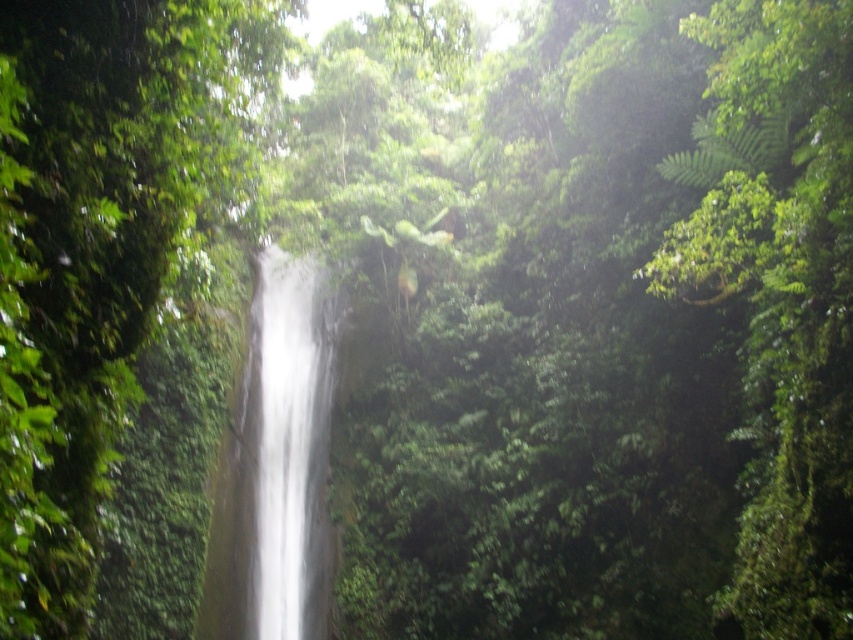
Who is shorter, green leafy tree at center or green leafy tree at right?

green leafy tree at center is shorter.

Is green leafy tree at center positioned before green leafy tree at right?

Yes, green leafy tree at center is closer to the viewer.

What do you see at coordinates (102, 246) in the screenshot? This screenshot has width=853, height=640. I see `green leafy tree at center` at bounding box center [102, 246].

Locate an element on the screen. This screenshot has width=853, height=640. green leafy tree at center is located at coordinates (102, 246).

Does green leafy tree at center have a greater width compared to white smooth waterfall at center?

Incorrect, green leafy tree at center's width does not surpass white smooth waterfall at center's.

Does point (117, 410) come in front of point (227, 449)?

Yes.

The width and height of the screenshot is (853, 640). I want to click on green leafy tree at center, so click(102, 246).

Between green leafy tree at right and white smooth waterfall at center, which one has less height?

white smooth waterfall at center is shorter.

Is green leafy tree at right shorter than white smooth waterfall at center?

In fact, green leafy tree at right may be taller than white smooth waterfall at center.

Who is more distant from viewer, (711, 141) or (326, 403)?

The point (326, 403) is more distant.

This screenshot has width=853, height=640. Find the location of `green leafy tree at right`. green leafy tree at right is located at coordinates (779, 294).